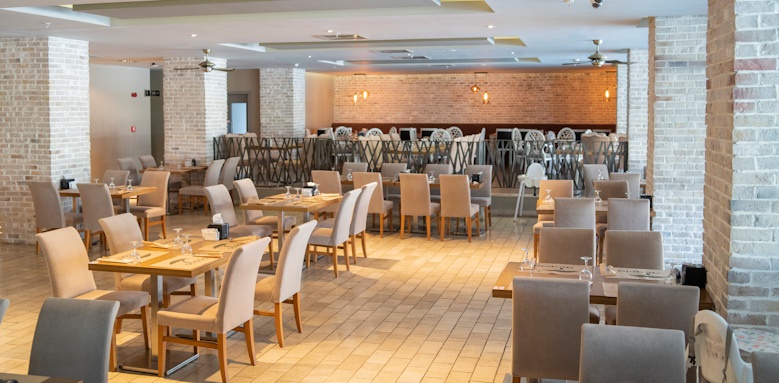
The height and width of the screenshot is (383, 779). In order to click on chairs with grid pattern on upper level in this screenshot , I will do `click(531, 132)`, `click(515, 135)`, `click(564, 130)`, `click(435, 132)`, `click(459, 132)`, `click(378, 129)`, `click(344, 129)`.